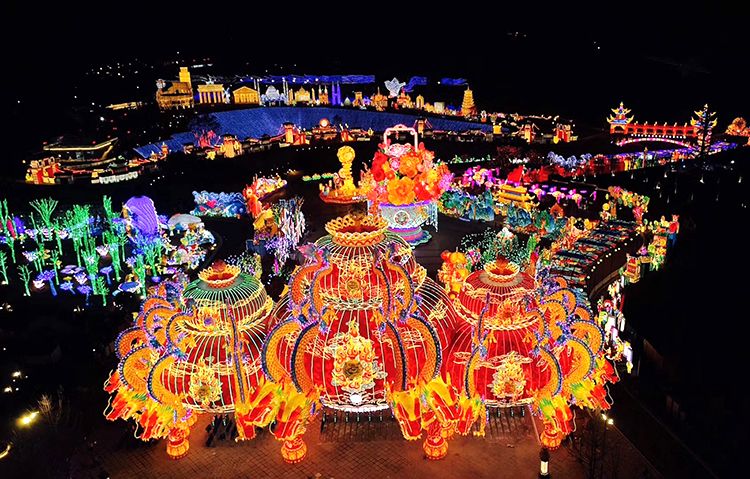
Locate an element on the screen. The width and height of the screenshot is (750, 479). red lights is located at coordinates (658, 125).